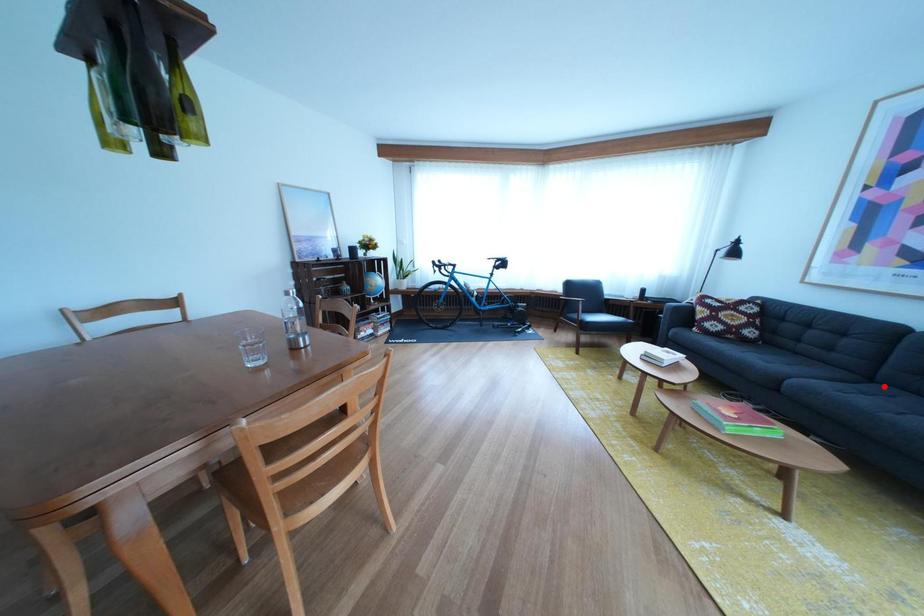
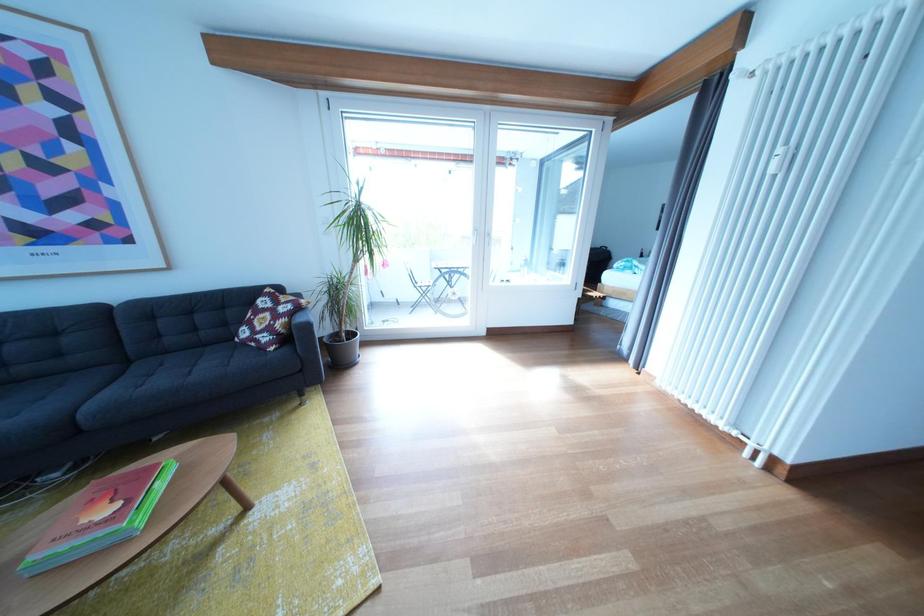
The point at the highlighted location is marked in the first image. Where is the corresponding point in the second image?

(141, 368)